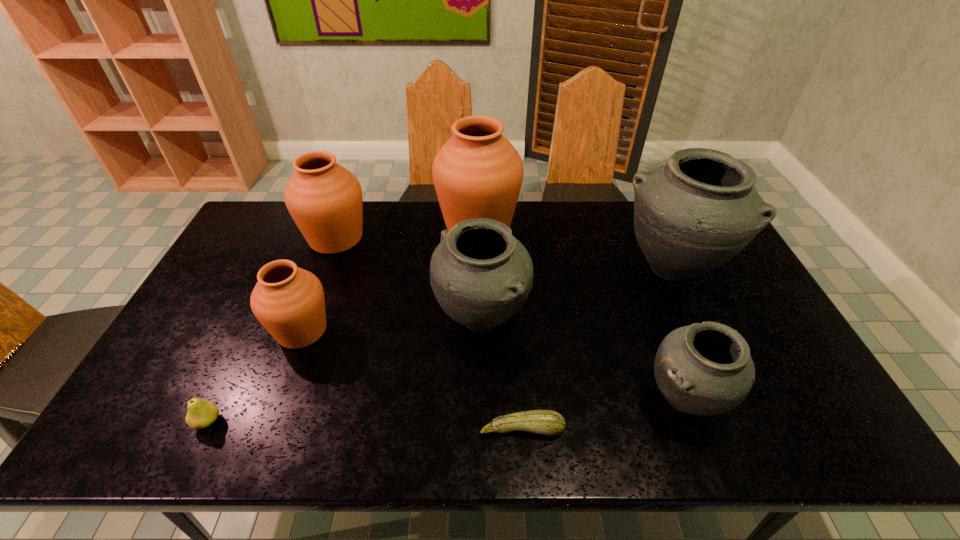
In order to click on the biggest brown urn in this screenshot , I will do `click(477, 173)`.

Identify the location of the biggest black urn. Image resolution: width=960 pixels, height=540 pixels. (691, 215).

Identify the location of the second smallest brown urn. The width and height of the screenshot is (960, 540). (324, 199).

Where is `the leftmost black urn`? Image resolution: width=960 pixels, height=540 pixels. the leftmost black urn is located at coordinates (481, 275).

Locate an element on the screen. Image resolution: width=960 pixels, height=540 pixels. the nearest brown urn is located at coordinates (288, 301).

You are a GUI agent. You are given a task and a screenshot of the screen. Output one action in this format:
    pyautogui.click(x=<x>, y=<y>)
    Task: Click on the smallest black urn
    
    Given the screenshot: What is the action you would take?
    pyautogui.click(x=705, y=369)

You are a GUI agent. You are given a task and a screenshot of the screen. Output one action in this format:
    pyautogui.click(x=<x>, y=<y>)
    Task: Click on the nearest black urn
    
    Given the screenshot: What is the action you would take?
    pyautogui.click(x=705, y=369)

Find the location of a particular element. This screenshot has width=960, height=540. the seventh tallest object is located at coordinates (201, 413).

Locate an element on the screen. The width and height of the screenshot is (960, 540). the shortest object is located at coordinates (547, 422).

This screenshot has height=540, width=960. I want to click on zucchini, so [x=547, y=422].